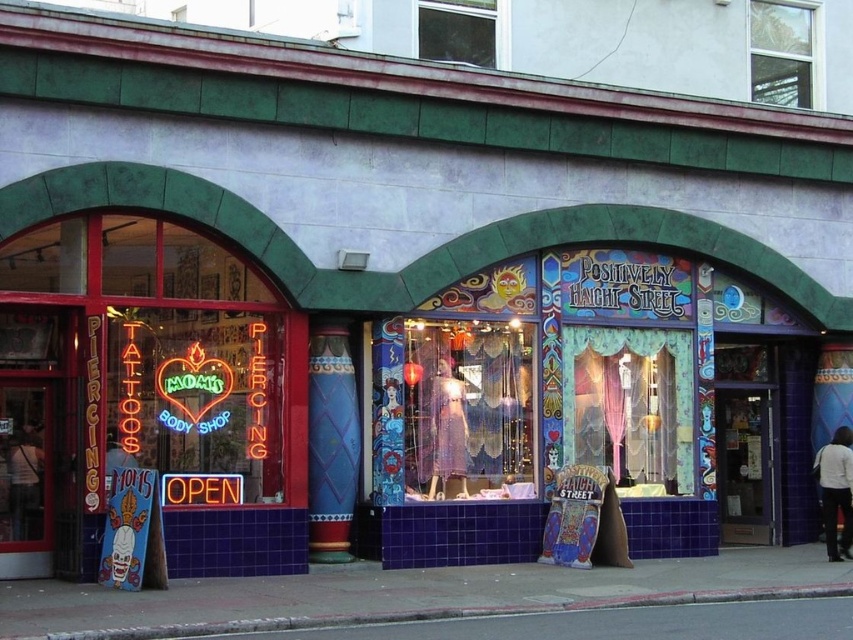
Question: Considering the relative positions of translucent fabric dress at center and metallic sequined dress at center in the image provided, where is translucent fabric dress at center located with respect to metallic sequined dress at center?

Choices:
 (A) right
 (B) left

Answer: (A)

Question: Which object is positioned farthest from the white fabric pants at lower right?

Choices:
 (A) translucent fabric dress at center
 (B) neonflexible/light-emittingneon sign at left

Answer: (B)

Question: Can you confirm if neonflexible/light-emittingneon sign at left is positioned to the left of white t-shirt at left?

Choices:
 (A) yes
 (B) no

Answer: (B)

Question: Which point is farther to the camera?

Choices:
 (A) metallic sequined dress at center
 (B) concrete at lower center
 (C) white fabric pants at lower right

Answer: (C)

Question: Which object is the farthest from the translucent fabric curtain at center?

Choices:
 (A) neonflexible/light-emittingneon sign at left
 (B) white fabric pants at lower right

Answer: (A)

Question: Is translucent fabric curtain at center bigger than white t-shirt at left?

Choices:
 (A) yes
 (B) no

Answer: (A)